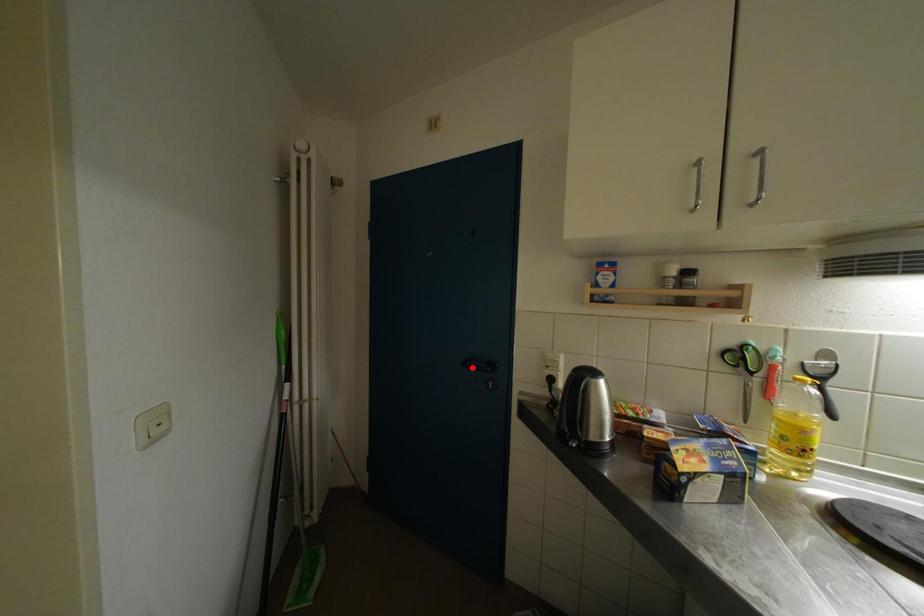
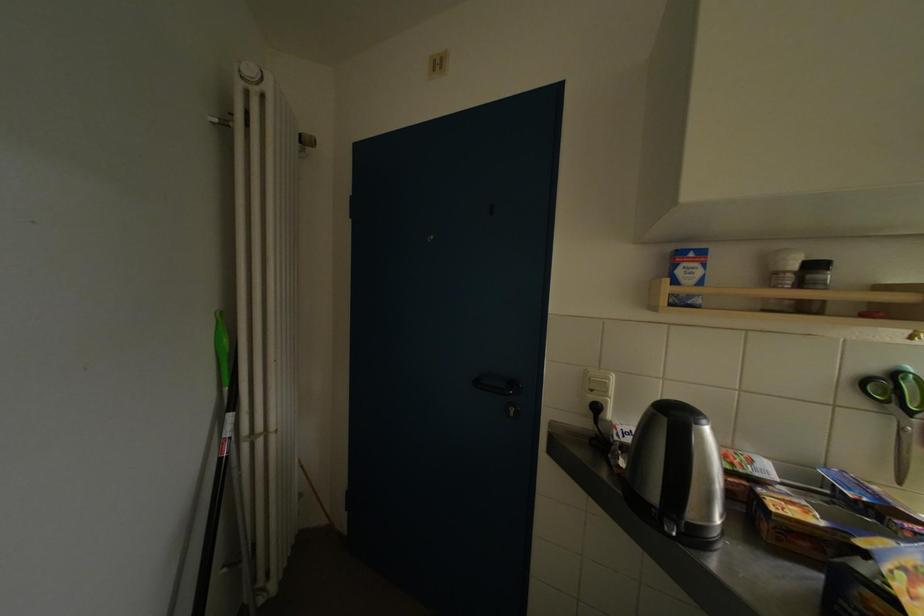
The point at the highlighted location is marked in the first image. Where is the corresponding point in the second image?

(484, 387)